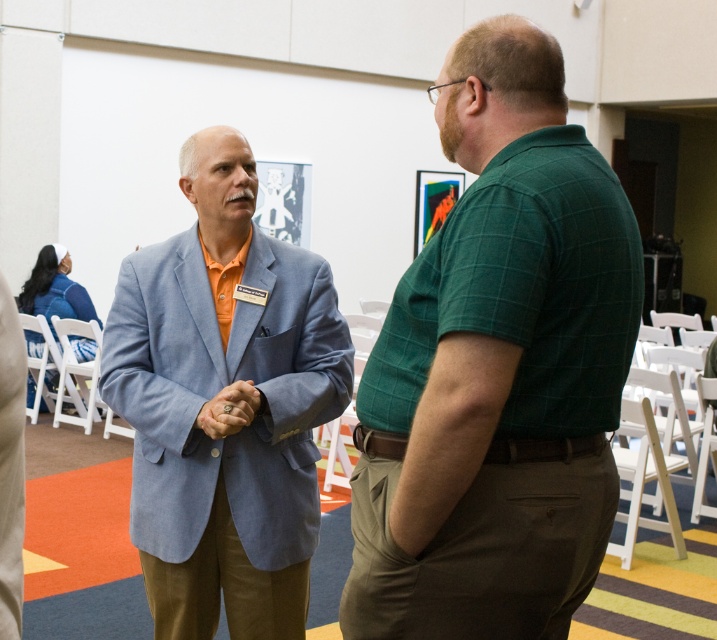
Question: Is green checkered shirt at right to the left of matte gold ring at center from the viewer's perspective?

Choices:
 (A) yes
 (B) no

Answer: (B)

Question: Among these objects, which one is nearest to the camera?

Choices:
 (A) matte gold ring at center
 (B) green checkered shirt at right

Answer: (B)

Question: Which point appears closest to the camera in this image?

Choices:
 (A) (280, 616)
 (B) (394, 520)

Answer: (B)

Question: Which object is the closest to the matte gold ring at center?

Choices:
 (A) light blue fabric blazer at center
 (B) green checkered shirt at right

Answer: (A)

Question: Is green checkered shirt at right positioned behind light blue fabric blazer at center?

Choices:
 (A) yes
 (B) no

Answer: (B)

Question: In this image, where is green checkered shirt at right located relative to light blue fabric blazer at center?

Choices:
 (A) below
 (B) above

Answer: (B)